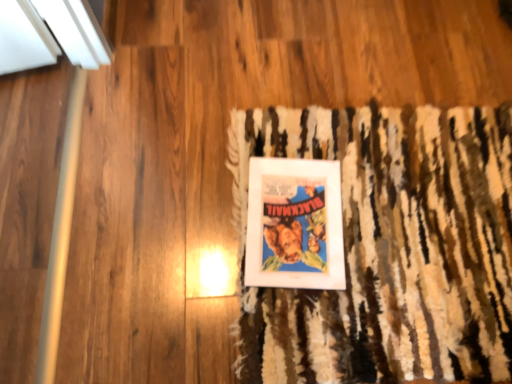
What are the coordinates of `blank space above textured brown doormat at center (from a real-world perspective)` in the screenshot? It's located at (375, 227).